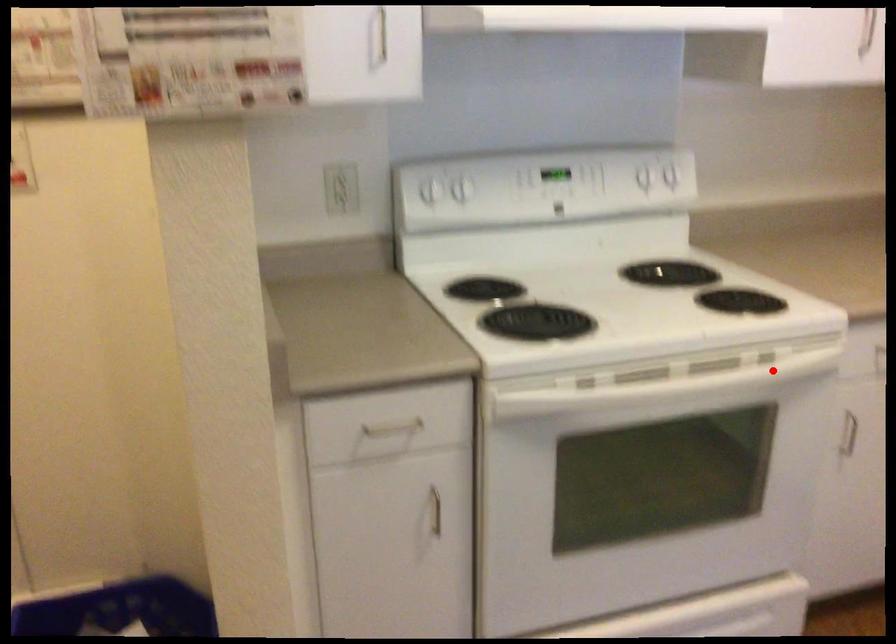
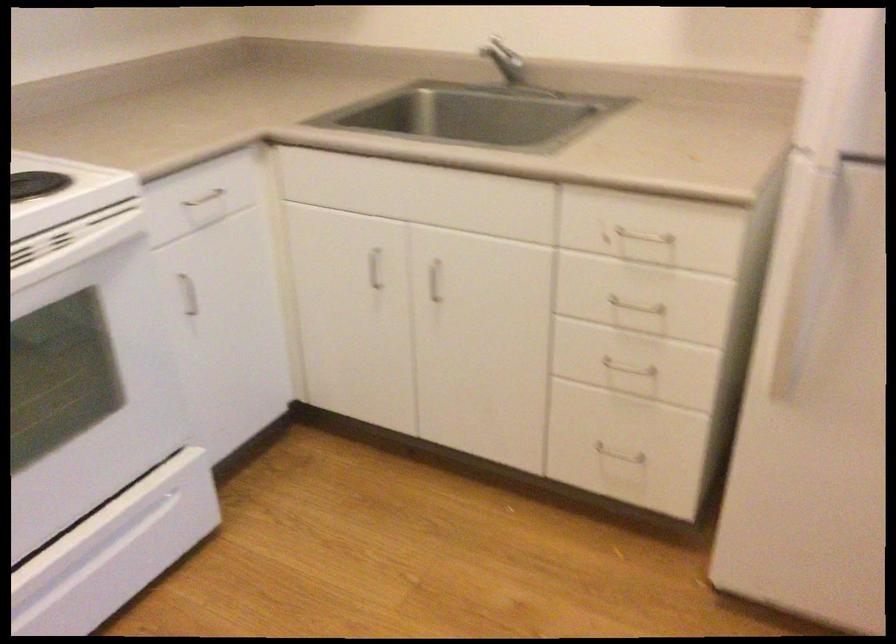
Locate, in the second image, the point that corresponds to the highlighted location in the first image.

(73, 243)